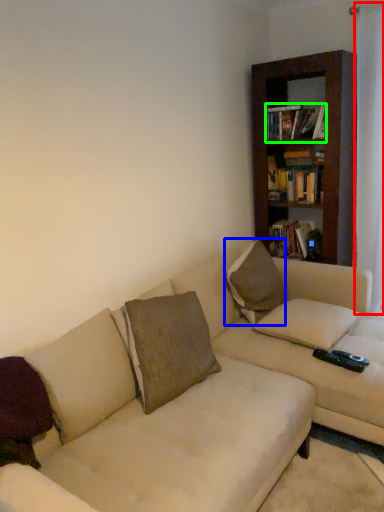
Question: Which object is the closest to the curtain (highlighted by a red box)? Choose among these: pillow (highlighted by a blue box) or book (highlighted by a green box).

Choices:
 (A) pillow
 (B) book

Answer: (B)